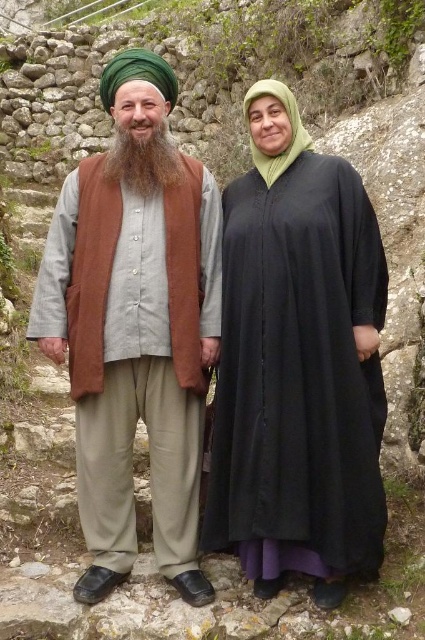
Question: Is brown woolen vest at left positioned at the back of brown fuzzy beard at center?

Choices:
 (A) no
 (B) yes

Answer: (A)

Question: Does brown fuzzy beard at center appear on the left side of green fabric headscarf at upper right?

Choices:
 (A) no
 (B) yes

Answer: (B)

Question: Which point is farther from the camera taking this photo?

Choices:
 (A) (275, 316)
 (B) (124, 170)
 (C) (277, 154)
 (D) (161, 442)

Answer: (B)

Question: Which point is closer to the camera?

Choices:
 (A) black matte dress at center
 (B) brown fuzzy beard at center
 (C) brown woolen vest at left
 (D) green fabric headscarf at upper right

Answer: (D)

Question: Which of these objects is positioned farthest from the brown woolen vest at left?

Choices:
 (A) green fabric headscarf at upper right
 (B) brown fuzzy beard at center
 (C) black matte dress at center

Answer: (A)

Question: Is black matte dress at center smaller than brown woolen vest at left?

Choices:
 (A) yes
 (B) no

Answer: (A)